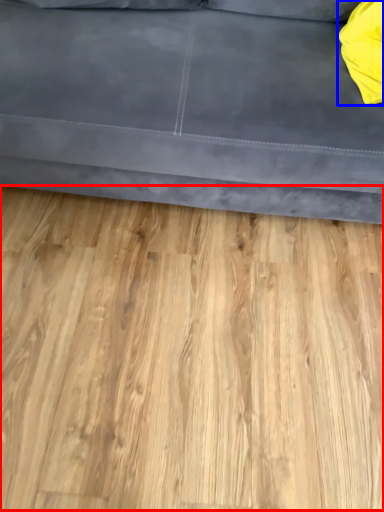
Question: Which object is closer to the camera taking this photo, hardwood (highlighted by a red box) or pillow (highlighted by a blue box)?

Choices:
 (A) hardwood
 (B) pillow

Answer: (A)